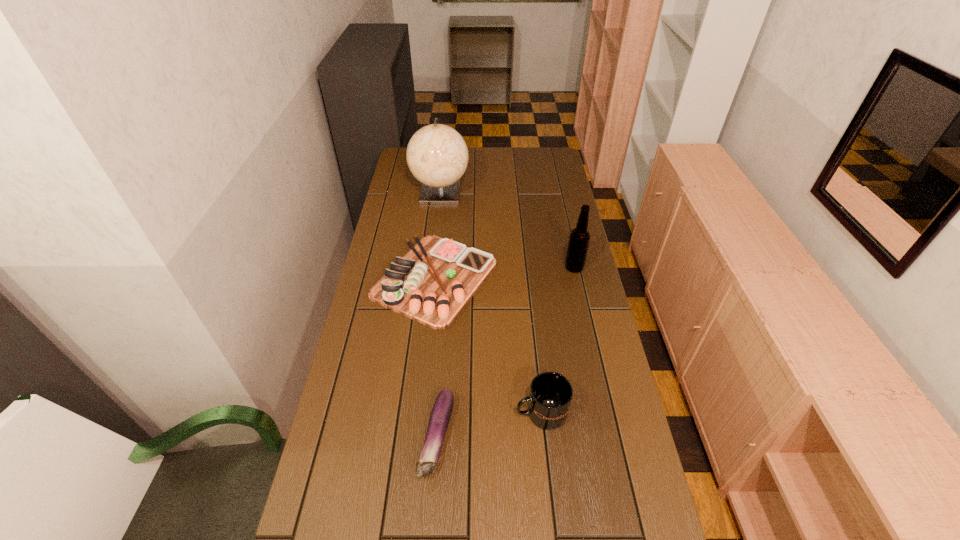
This screenshot has width=960, height=540. What are the coordinates of `free space located with the handle on the side of the third tallest object` in the screenshot? It's located at (418, 413).

Where is `free space located with the handle on the side of the third tallest object`? This screenshot has height=540, width=960. free space located with the handle on the side of the third tallest object is located at coordinates (421, 413).

Locate an element on the screen. This screenshot has width=960, height=540. vacant area situated with the handle on the side of the third tallest object is located at coordinates (370, 413).

Locate an element on the screen. This screenshot has width=960, height=540. vacant area located on the right of the second shortest object is located at coordinates (511, 279).

This screenshot has height=540, width=960. I want to click on blank space located on the left of the eggplant, so click(397, 438).

Locate an element on the screen. Image resolution: width=960 pixels, height=540 pixels. globe that is at the left edge is located at coordinates (437, 155).

What are the coordinates of `platter that is positioned at the left edge` in the screenshot? It's located at (431, 284).

At what (x,y) coordinates should I click in order to perform the action: click on beer bottle at the right edge. Please return your answer as a coordinate pair (x, y). The width and height of the screenshot is (960, 540). Looking at the image, I should click on (x=579, y=239).

At what (x,y) coordinates should I click in order to perform the action: click on mug located at the right edge. Please return your answer as a coordinate pair (x, y). Looking at the image, I should click on (551, 393).

At what (x,y) coordinates should I click in order to perform the action: click on vacant space at the far edge of the desktop. Please return your answer as a coordinate pair (x, y). Looking at the image, I should click on (508, 172).